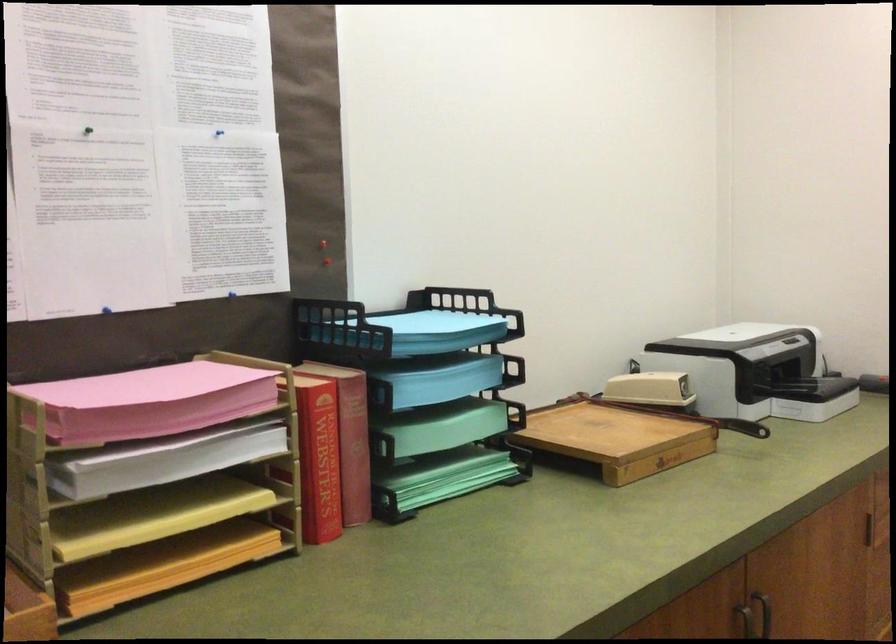
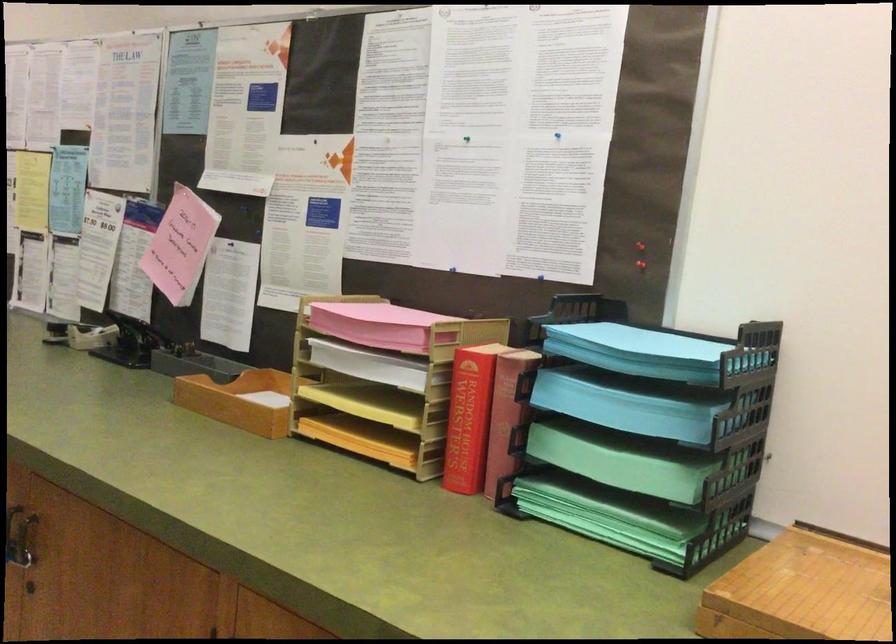
The point at (461,476) is marked in the first image. Where is the corresponding point in the second image?

(605, 512)